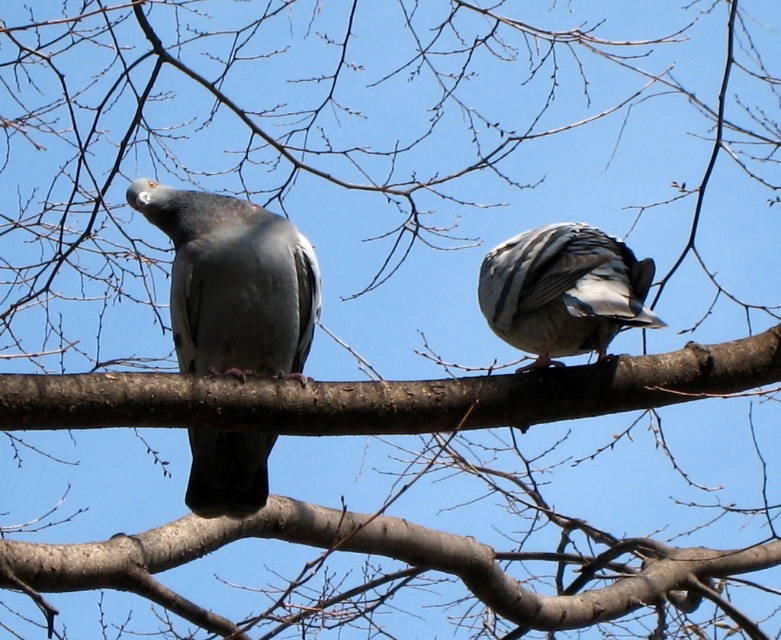
Does point (98, 424) come in front of point (494, 276)?

Yes, point (98, 424) is in front of point (494, 276).

Who is more distant from viewer, (648, 401) or (576, 316)?

The point (648, 401) is more distant.

You are a GUI agent. You are given a task and a screenshot of the screen. Output one action in this format:
    pyautogui.click(x=<x>, y=<y>)
    Task: Click on the brown rough branch at center
    The height and width of the screenshot is (640, 781).
    Given the screenshot: What is the action you would take?
    pyautogui.click(x=389, y=396)

Does point (188, 500) come in front of point (558, 241)?

No.

Does gray matte pigeon at left have a greater width compared to speckled gray pigeon at center?

Indeed, gray matte pigeon at left has a greater width compared to speckled gray pigeon at center.

You are a GUI agent. You are given a task and a screenshot of the screen. Output one action in this format:
    pyautogui.click(x=<x>, y=<y>)
    Task: Click on the gray matte pigeon at left
    The width and height of the screenshot is (781, 640).
    Given the screenshot: What is the action you would take?
    [x=234, y=284]

Is point (387, 420) closer to viewer compared to point (261, 355)?

Yes, point (387, 420) is closer to viewer.

The width and height of the screenshot is (781, 640). I want to click on brown rough branch at center, so click(x=389, y=396).